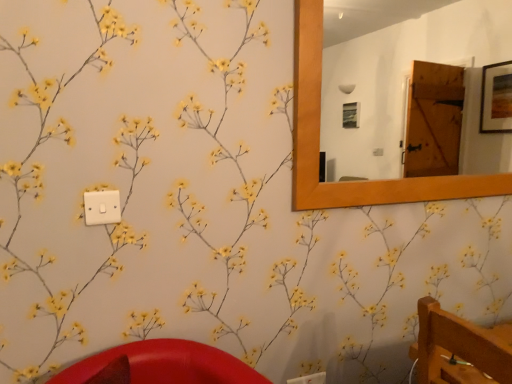
Find the location of a particular element. Image resolution: width=512 pixels, height=384 pixels. wooden frame mirror at upper right is located at coordinates (405, 86).

What do you see at coordinates (405, 86) in the screenshot?
I see `wooden frame mirror at upper right` at bounding box center [405, 86].

This screenshot has width=512, height=384. I want to click on white plastic light switch at upper left, so click(102, 207).

The height and width of the screenshot is (384, 512). What do you see at coordinates (102, 207) in the screenshot? I see `white plastic light switch at upper left` at bounding box center [102, 207].

The image size is (512, 384). In order to click on wooden frame mirror at upper right in this screenshot , I will do `click(405, 86)`.

Based on their positions, is wooden frame mirror at upper right located to the left or right of white plastic light switch at upper left?

wooden frame mirror at upper right is to the right of white plastic light switch at upper left.

Is wooden frame mirror at upper right positioned before white plastic light switch at upper left?

No.

Is point (496, 172) less distant than point (117, 204)?

No, it is not.

From the image's perspective, which is above, wooden frame mirror at upper right or white plastic light switch at upper left?

wooden frame mirror at upper right appears higher in the image.

From a real-world perspective, which object rests below the other?

white plastic light switch at upper left is physically lower.

Considering the sizes of objects wooden frame mirror at upper right and white plastic light switch at upper left in the image provided, who is wider, wooden frame mirror at upper right or white plastic light switch at upper left?

wooden frame mirror at upper right.

Is wooden frame mirror at upper right taller than white plastic light switch at upper left?

Indeed, wooden frame mirror at upper right has a greater height compared to white plastic light switch at upper left.

Considering the relative sizes of wooden frame mirror at upper right and white plastic light switch at upper left in the image provided, is wooden frame mirror at upper right bigger than white plastic light switch at upper left?

Indeed, wooden frame mirror at upper right has a larger size compared to white plastic light switch at upper left.

Is wooden frame mirror at upper right inside the boundaries of white plastic light switch at upper left, or outside?

wooden frame mirror at upper right is not inside white plastic light switch at upper left, it's outside.

Is wooden frame mirror at upper right next to white plastic light switch at upper left?

wooden frame mirror at upper right is not next to white plastic light switch at upper left, and they're not touching.

Is wooden frame mirror at upper right aimed at white plastic light switch at upper left?

No, wooden frame mirror at upper right is not facing towards white plastic light switch at upper left.

How many degrees apart are the facing directions of wooden frame mirror at upper right and white plastic light switch at upper left?

0.269 degrees separate the facing orientations of wooden frame mirror at upper right and white plastic light switch at upper left.

Measure the distance from wooden frame mirror at upper right to white plastic light switch at upper left.

The distance of wooden frame mirror at upper right from white plastic light switch at upper left is 4.55 meters.

Locate an element on the screen. light switch that is on the left side of wooden frame mirror at upper right is located at coordinates (102, 207).

In the scene shown: Does white plastic light switch at upper left appear on the right side of wooden frame mirror at upper right?

Incorrect, white plastic light switch at upper left is not on the right side of wooden frame mirror at upper right.

Which is behind, white plastic light switch at upper left or wooden frame mirror at upper right?

Positioned behind is wooden frame mirror at upper right.

Between point (86, 204) and point (454, 42), which one is positioned in front?

The point (86, 204) is in front.

From the image's perspective, relative to wooden frame mirror at upper right, is white plastic light switch at upper left above or below?

Clearly, from the image's perspective, white plastic light switch at upper left is below wooden frame mirror at upper right.

Consider the image. From a real-world perspective, which object stands above the other?

wooden frame mirror at upper right, from a real-world perspective.

Is white plastic light switch at upper left wider or thinner than wooden frame mirror at upper right?

Clearly, white plastic light switch at upper left has less width compared to wooden frame mirror at upper right.

From the picture: Considering the sizes of objects white plastic light switch at upper left and wooden frame mirror at upper right in the image provided, who is shorter, white plastic light switch at upper left or wooden frame mirror at upper right?

With less height is white plastic light switch at upper left.

Can you confirm if white plastic light switch at upper left is smaller than wooden frame mirror at upper right?

Correct, white plastic light switch at upper left occupies less space than wooden frame mirror at upper right.

Choose the correct answer: Is white plastic light switch at upper left inside wooden frame mirror at upper right or outside it?

white plastic light switch at upper left lies outside wooden frame mirror at upper right.

From the picture: Is white plastic light switch at upper left positioned far away from wooden frame mirror at upper right?

That's right, there is a large distance between white plastic light switch at upper left and wooden frame mirror at upper right.

Is white plastic light switch at upper left oriented away from wooden frame mirror at upper right?

No.

Identify the location of mirror that appears above the white plastic light switch at upper left (from the image's perspective). (405, 86).

I want to click on mirror on the right side of white plastic light switch at upper left, so click(405, 86).

This screenshot has height=384, width=512. I want to click on light switch in front of the wooden frame mirror at upper right, so click(x=102, y=207).